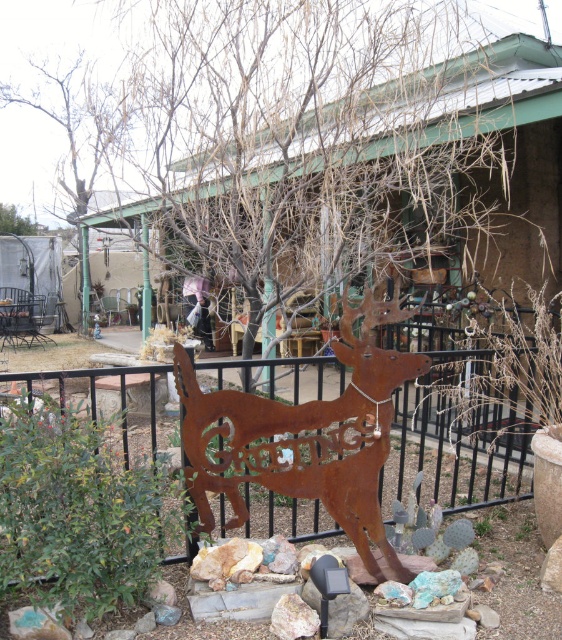
Question: Among these objects, which one is farthest from the camera?

Choices:
 (A) rusty metal deer at center
 (B) brown wood tree at upper left

Answer: (B)

Question: Is rusty metal deer at center closer to the viewer compared to brown wood tree at upper left?

Choices:
 (A) no
 (B) yes

Answer: (B)

Question: Which point appears farthest from the camera in this image?

Choices:
 (A) [375, 380]
 (B) [28, 232]

Answer: (B)

Question: Can you confirm if rusty metal deer at center is positioned below brown wood tree at upper left?

Choices:
 (A) no
 (B) yes

Answer: (B)

Question: Can you confirm if rusty metal deer at center is thinner than brown wood tree at upper left?

Choices:
 (A) no
 (B) yes

Answer: (B)